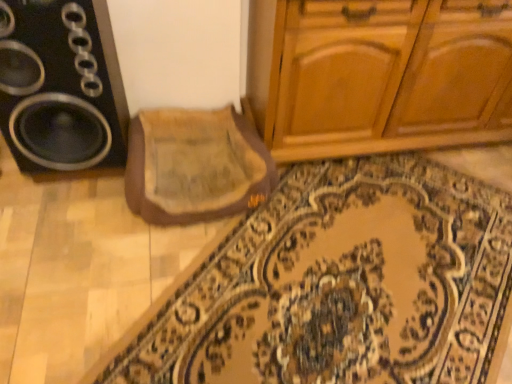
Question: In terms of width, does beige fabric mat at center look wider or thinner when compared to black plastic speaker at left?

Choices:
 (A) thin
 (B) wide

Answer: (B)

Question: From a real-world perspective, is beige fabric mat at center above or below black plastic speaker at left?

Choices:
 (A) above
 (B) below

Answer: (B)

Question: Which of these objects is positioned closest to the beige fabric mat at center?

Choices:
 (A) black plastic speaker at left
 (B) carpeted mat at center

Answer: (A)

Question: Which is farther from the carpeted mat at center?

Choices:
 (A) black plastic speaker at left
 (B) beige fabric mat at center

Answer: (A)